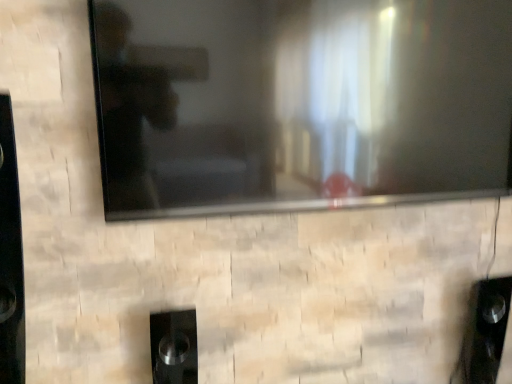
Question: Visually, is black glossy tv at upper center positioned to the left or to the right of black glossy speaker at lower center?

Choices:
 (A) left
 (B) right

Answer: (B)

Question: Looking at their shapes, would you say black glossy tv at upper center is wider or thinner than black glossy speaker at lower center?

Choices:
 (A) thin
 (B) wide

Answer: (A)

Question: From a real-world perspective, is black glossy tv at upper center positioned above or below black glossy speaker at lower center?

Choices:
 (A) below
 (B) above

Answer: (B)

Question: Relative to black glossy tv at upper center, is black glossy speaker at lower center in front or behind?

Choices:
 (A) front
 (B) behind

Answer: (B)

Question: Does point (159, 382) appear closer or farther from the camera than point (313, 152)?

Choices:
 (A) closer
 (B) farther

Answer: (B)

Question: Choose the correct answer: Is black glossy speaker at lower center inside black glossy tv at upper center or outside it?

Choices:
 (A) outside
 (B) inside

Answer: (A)

Question: From the image's perspective, relative to black glossy tv at upper center, is black glossy speaker at lower center above or below?

Choices:
 (A) above
 (B) below

Answer: (B)